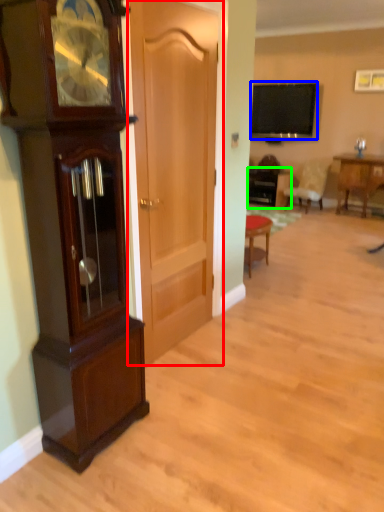
Question: Which object is positioned closest to door (highlighted by a red box)? Select from television (highlighted by a blue box) and table (highlighted by a green box).

Choices:
 (A) television
 (B) table

Answer: (B)